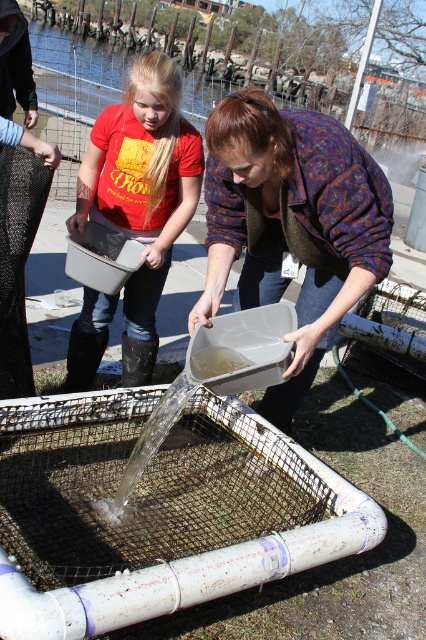
You are standing at the point labeled point (100, 195) and want to move to the point labeled point (311, 273). Is the point you want to reach in front of or behind your current position?

Point (311, 273) is in front of point (100, 195), so the destination is in front of your current position.

You are a volunteer helping with a water filtration project. You see the matte plastic tray at center and the matte plastic bucket at left. Which one is positioned to the right side?

The matte plastic tray at center is positioned to the right of the matte plastic bucket at left.